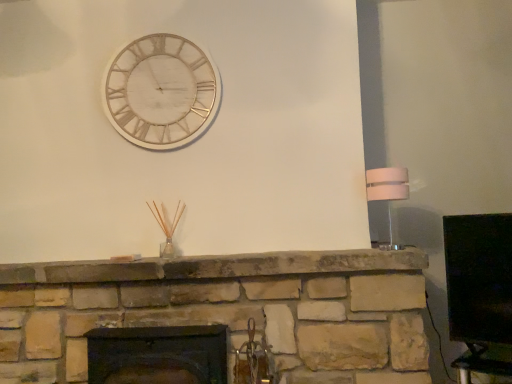
Where is `blank area beneath white marble clock at upper center (from a real-world perspective)`? blank area beneath white marble clock at upper center (from a real-world perspective) is located at coordinates (181, 252).